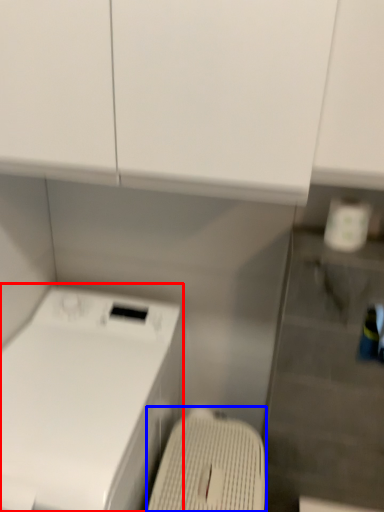
Question: Which point is closer to the camera, home appliance (highlighted by a red box) or washing machine (highlighted by a blue box)?

Choices:
 (A) home appliance
 (B) washing machine

Answer: (A)